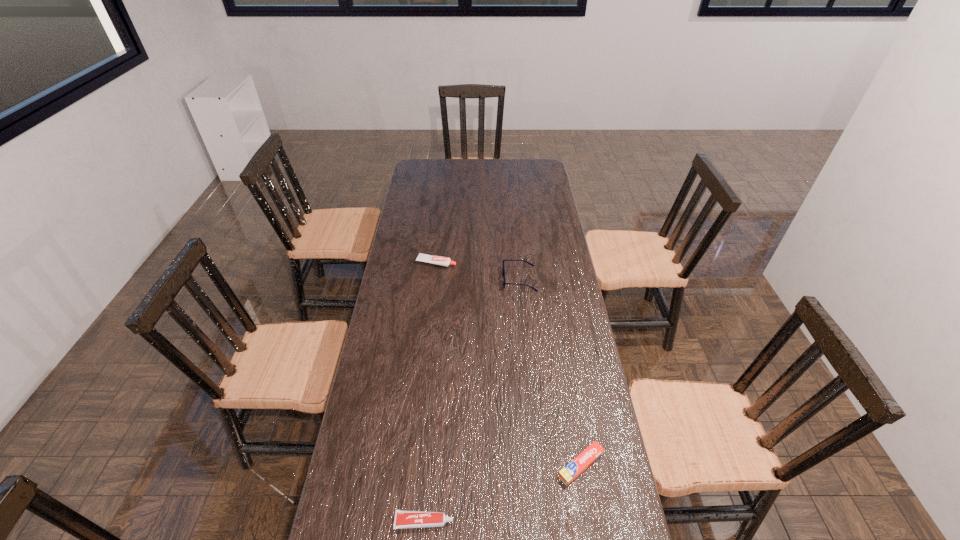
Select which object appears as the third closest to the tallest toothpaste. Please provide its 2D coordinates. Your answer should be formatted as a tuple, i.e. [(x, y)], where the tuple contains the x and y coordinates of a point satisfying the conditions above.

[(403, 519)]

The image size is (960, 540). I want to click on toothpaste object that ranks as the closest to the nearest object, so click(571, 471).

Locate an element on the screen. the second closest toothpaste relative to the nearest toothpaste is located at coordinates (438, 260).

The image size is (960, 540). In order to click on vacant space that satisfies the following two spatial constraints: 1. on the front side of the third shortest object; 2. on the left side of the second farthest toothpaste in this screenshot , I will do `click(414, 465)`.

Where is `free space that satisfies the following two spatial constraints: 1. on the front-facing side of the second farthest toothpaste; 2. on the left side of the tallest object`? The width and height of the screenshot is (960, 540). free space that satisfies the following two spatial constraints: 1. on the front-facing side of the second farthest toothpaste; 2. on the left side of the tallest object is located at coordinates (538, 465).

At what (x,y) coordinates should I click in order to perform the action: click on vacant point that satisfies the following two spatial constraints: 1. on the front-facing side of the spectacles; 2. on the left side of the second nearest object. Please return your answer as a coordinate pair (x, y). The image size is (960, 540). Looking at the image, I should click on (538, 465).

Locate an element on the screen. vacant space that satisfies the following two spatial constraints: 1. on the front-facing side of the spectacles; 2. on the left side of the second nearest toothpaste is located at coordinates (538, 465).

Where is `vacant area in the image that satisfies the following two spatial constraints: 1. on the front-facing side of the tallest object; 2. on the right side of the rightmost toothpaste`? This screenshot has width=960, height=540. vacant area in the image that satisfies the following two spatial constraints: 1. on the front-facing side of the tallest object; 2. on the right side of the rightmost toothpaste is located at coordinates 538,465.

At what (x,y) coordinates should I click in order to perform the action: click on vacant point that satisfies the following two spatial constraints: 1. on the front-facing side of the third farthest object; 2. on the left side of the tallest object. Please return your answer as a coordinate pair (x, y). The width and height of the screenshot is (960, 540). Looking at the image, I should click on (538, 465).